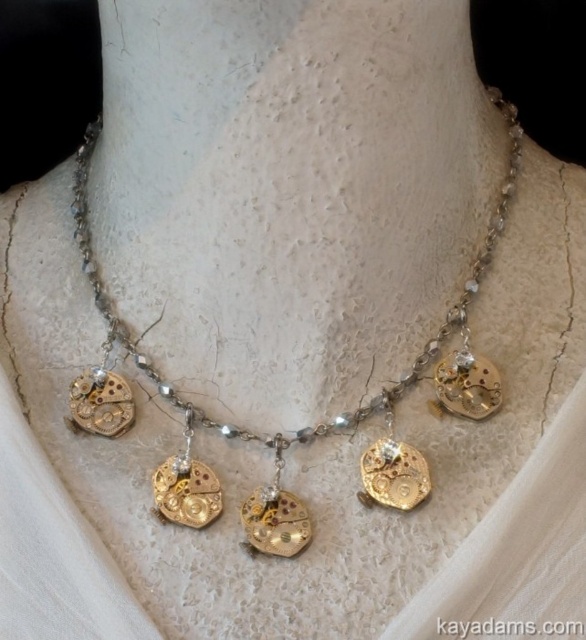
Can you confirm if gold metallic watch parts at center is positioned to the right of gold metallic watch mechanism at center?

No, gold metallic watch parts at center is not to the right of gold metallic watch mechanism at center.

Looking at this image, can you confirm if gold metallic watch parts at center is taller than gold metallic watch mechanism at center?

Yes.

This screenshot has height=640, width=586. What do you see at coordinates (298, 429) in the screenshot? I see `gold metallic watch parts at center` at bounding box center [298, 429].

This screenshot has height=640, width=586. Find the location of `gold metallic watch parts at center`. gold metallic watch parts at center is located at coordinates click(298, 429).